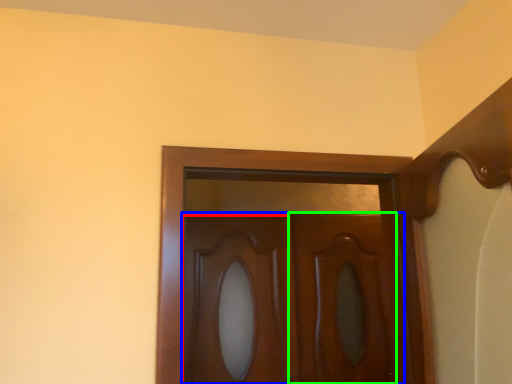
Question: Estimate the real-world distances between objects in this image. Which object is closer to cabinetry (highlighted by a red box), door (highlighted by a blue box) or screen door (highlighted by a green box)?

Choices:
 (A) door
 (B) screen door

Answer: (A)